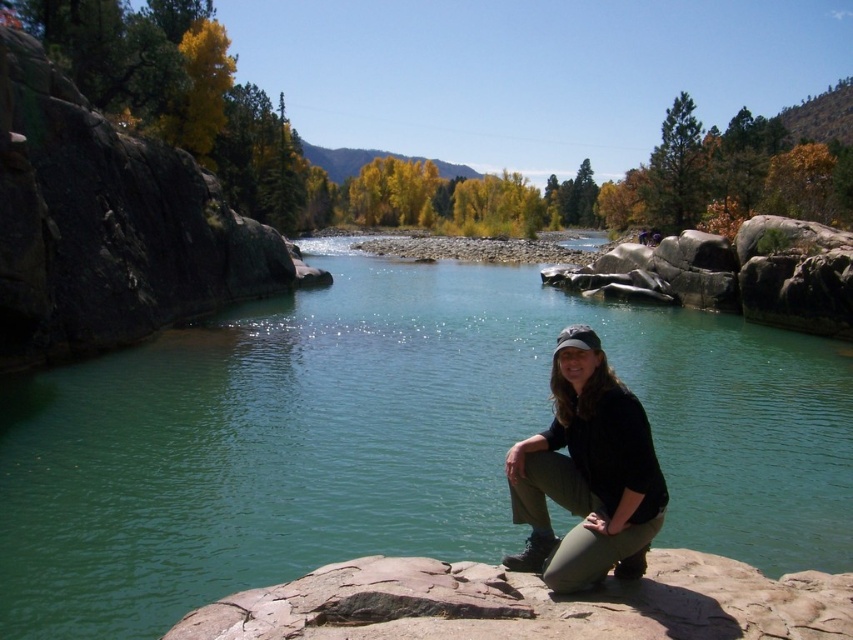
From the picture: You are planning to cross the river using the rocks in the scene. The clear water at center is deeper than the black matte pants at lower center. Which object should you step on to avoid getting your shoes wet?

You should step on the black matte pants at lower center because it is smaller and likely represents a dry rock or surface above the clear water at center, which is deeper and larger.

You are standing at the edge of the river and want to cross to the other side. The clear water at center is 55.56 feet away from you. Do you think you can jump across the river in one leap?

The clear water at center is 55.56 feet away from the viewer. Since the average human jump distance is around 10 feet, you cannot jump across the river in one leap as the distance is too great.